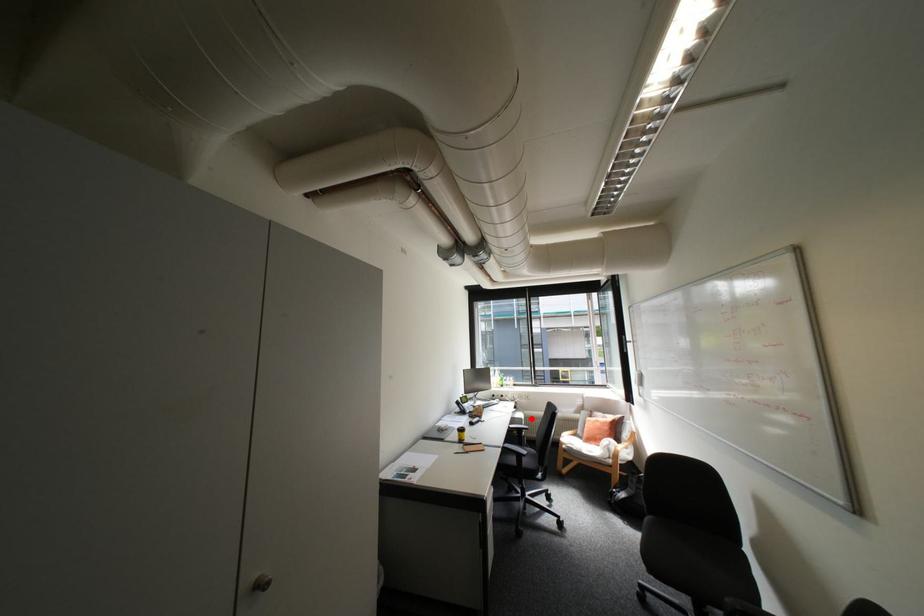
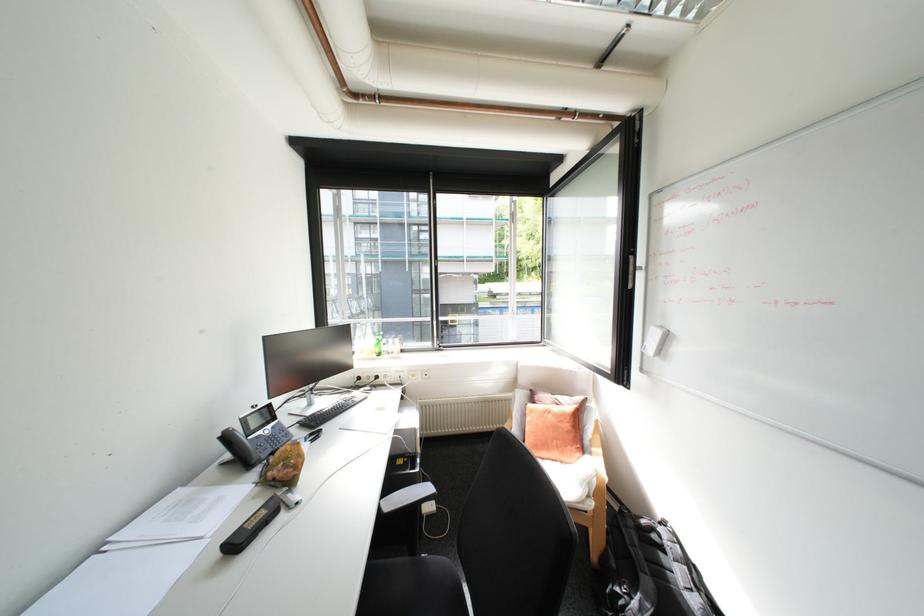
Question: I am providing you with two images of the same scene from different viewpoints. In image1, a red point is highlighted. Considering the same 3D point in image2, which of the following is correct?

Choices:
 (A) It is closer
 (B) It is farther

Answer: (A)